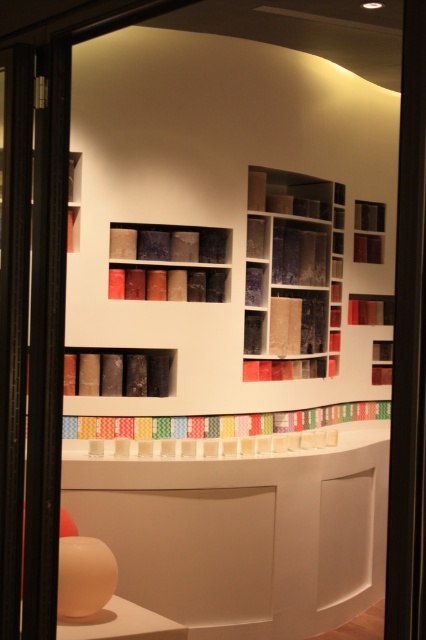
Question: Estimate the real-world distances between objects in this image. Which object is closer to the matte black bookshelf at center?

Choices:
 (A) matte black tubes at center
 (B) textured fabric at center

Answer: (A)

Question: Can you confirm if textured fabric at center is smaller than matte black bookshelf at center?

Choices:
 (A) yes
 (B) no

Answer: (B)

Question: Is textured fabric at center wider than matte black bookshelf at center?

Choices:
 (A) yes
 (B) no

Answer: (A)

Question: Considering the real-world distances, which object is farthest from the matte black tubes at center?

Choices:
 (A) textured fabric at center
 (B) transparent glass door at left
 (C) matte black bookshelf at center

Answer: (B)

Question: Is textured fabric at center positioned at the back of matte black bookshelf at center?

Choices:
 (A) yes
 (B) no

Answer: (A)

Question: Which of the following is the closest to the observer?

Choices:
 (A) (143, 378)
 (B) (20, 580)
 (C) (126, 285)
 (D) (250, 198)

Answer: (B)